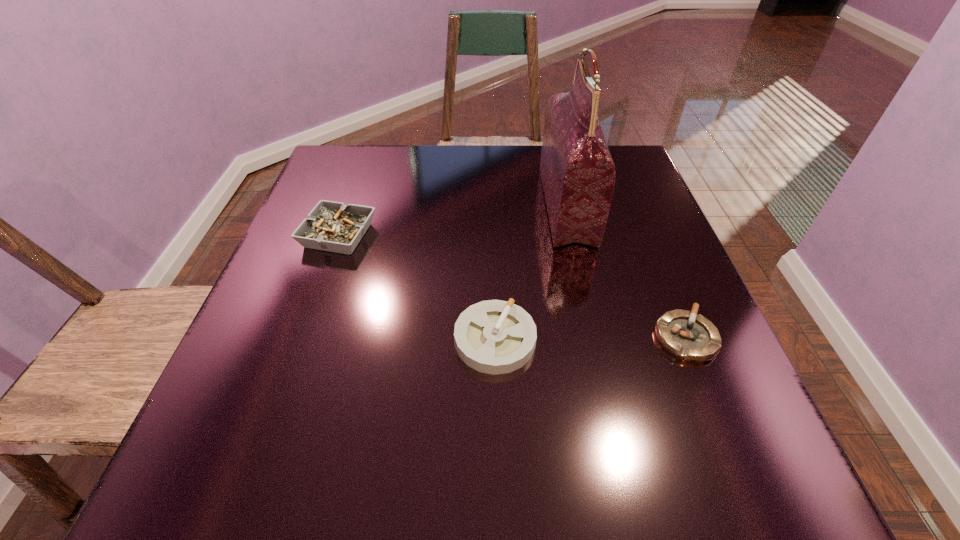
The height and width of the screenshot is (540, 960). I want to click on the tallest object, so click(577, 172).

Identify the location of the third object from left to right. (577, 172).

The image size is (960, 540). In order to click on the leftmost object in this screenshot , I will do `click(331, 226)`.

Where is `the leftmost ashtray`? The height and width of the screenshot is (540, 960). the leftmost ashtray is located at coordinates (331, 226).

Locate an element on the screen. The width and height of the screenshot is (960, 540). the second ashtray from right to left is located at coordinates (495, 337).

This screenshot has width=960, height=540. Find the location of `the rightmost object`. the rightmost object is located at coordinates (690, 337).

The height and width of the screenshot is (540, 960). Find the location of `the shortest ashtray`. the shortest ashtray is located at coordinates point(690,337).

Where is `vacant space located 0.400m on the front-facing side of the second object from right to left`? vacant space located 0.400m on the front-facing side of the second object from right to left is located at coordinates (377, 206).

Find the location of a particular element. The width and height of the screenshot is (960, 540). free region located 0.100m on the front-facing side of the second object from right to left is located at coordinates (503, 206).

Locate an element on the screen. The height and width of the screenshot is (540, 960). free region located 0.370m on the front-facing side of the second object from right to left is located at coordinates (390, 206).